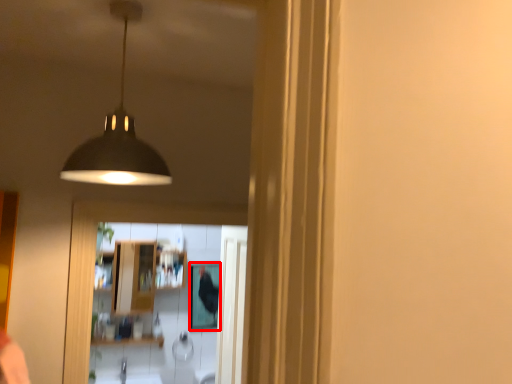
Question: Observing the image, what is the correct spatial positioning of mirror (annotated by the red box) in reference to lamp?

Choices:
 (A) left
 (B) right

Answer: (B)